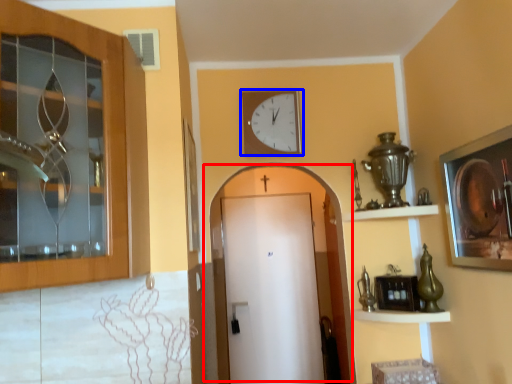
Question: Which object is further to the camera taking this photo, door (highlighted by a red box) or wall clock (highlighted by a blue box)?

Choices:
 (A) door
 (B) wall clock

Answer: (A)